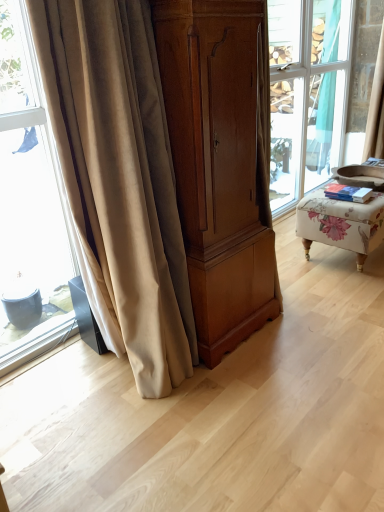
Measure the distance between point (237, 267) and camera.

Point (237, 267) is 5.60 feet away from camera.

Where is `floral fabric ottoman at right`? floral fabric ottoman at right is located at coordinates (341, 223).

Locate an element on the screen. The width and height of the screenshot is (384, 512). beige fabric curtain at upper right, which is the 1th curtain in top-to-bottom order is located at coordinates (376, 109).

Consider the image. From the image's perspective, does beige fabric curtain at upper right, the second curtain ordered from the bottom, appear higher than floral fabric ottoman at right?

Yes, from the image's perspective, beige fabric curtain at upper right, the second curtain ordered from the bottom, is on top of floral fabric ottoman at right.

Considering the sizes of beige fabric curtain at upper right, the first curtain in the back-to-front sequence, and floral fabric ottoman at right in the image, is beige fabric curtain at upper right, the first curtain in the back-to-front sequence, bigger or smaller than floral fabric ottoman at right?

In the image, beige fabric curtain at upper right, the first curtain in the back-to-front sequence, appears to be smaller than floral fabric ottoman at right.

Where is `curtain behind the floral fabric ottoman at right`? This screenshot has width=384, height=512. curtain behind the floral fabric ottoman at right is located at coordinates (376, 109).

From the picture: In terms of width, does beige fabric curtain at upper right, which is the 1th curtain in top-to-bottom order, look wider or thinner when compared to floral fabric ottoman at right?

beige fabric curtain at upper right, which is the 1th curtain in top-to-bottom order, is thinner than floral fabric ottoman at right.

Is beige velvet curtain at left, arranged as the second curtain when viewed from the right, at the left side of beige fabric curtain at upper right, the first curtain in the back-to-front sequence?

Yes, beige velvet curtain at left, arranged as the second curtain when viewed from the right, is to the left of beige fabric curtain at upper right, the first curtain in the back-to-front sequence.

Which is less distant, (108, 201) or (366, 124)?

Clearly, point (108, 201) is closer to the camera than point (366, 124).

Is beige velvet curtain at left, the 1th curtain positioned from the front, facing towards beige fabric curtain at upper right, the second curtain ordered from the bottom?

No, beige velvet curtain at left, the 1th curtain positioned from the front, is not facing towards beige fabric curtain at upper right, the second curtain ordered from the bottom.

How different are the orientations of matte wood cabinet at center and beige fabric curtain at upper right, the first curtain when ordered from right to left, in degrees?

matte wood cabinet at center and beige fabric curtain at upper right, the first curtain when ordered from right to left, are facing 1.39 degrees away from each other.

Considering the relative positions of matte wood cabinet at center and beige fabric curtain at upper right, the second curtain positioned from the front, in the image provided, is matte wood cabinet at center to the right of beige fabric curtain at upper right, the second curtain positioned from the front, from the viewer's perspective?

Incorrect, matte wood cabinet at center is not on the right side of beige fabric curtain at upper right, the second curtain positioned from the front.

Is matte wood cabinet at center far away from beige fabric curtain at upper right, positioned as the second curtain in left-to-right order?

Yes, matte wood cabinet at center is far from beige fabric curtain at upper right, positioned as the second curtain in left-to-right order.

The height and width of the screenshot is (512, 384). I want to click on curtain above the matte wood cabinet at center (from the image's perspective), so click(x=376, y=109).

Between beige fabric curtain at upper right, the second curtain positioned from the front, and matte wood cabinet at center, which one has larger width?

Wider between the two is matte wood cabinet at center.

Measure the distance from beige fabric curtain at upper right, the first curtain when ordered from right to left, to matte wood cabinet at center.

8.12 feet.

At what (x,y) coordinates should I click in order to perform the action: click on cabinetry to the left of beige fabric curtain at upper right, the second curtain positioned from the front. Please return your answer as a coordinate pair (x, y). The image size is (384, 512). Looking at the image, I should click on (217, 164).

Are beige fabric curtain at upper right, which is the 1th curtain in top-to-bottom order, and matte wood cabinet at center far apart?

beige fabric curtain at upper right, which is the 1th curtain in top-to-bottom order, is far away from matte wood cabinet at center.

How distant is floral fabric ottoman at right from beige velvet curtain at left, which is the 2th curtain in top-to-bottom order?

1.24 meters.

Is floral fabric ottoman at right touching beige velvet curtain at left, which is the first curtain from left to right?

No, floral fabric ottoman at right is not in contact with beige velvet curtain at left, which is the first curtain from left to right.

Is point (350, 228) positioned in front of point (70, 125)?

No.

Consider the image. From the image's perspective, is floral fabric ottoman at right located beneath beige velvet curtain at left, arranged as the second curtain when viewed from the right?

No.

Can you tell me how much beige fabric curtain at upper right, the second curtain positioned from the front, and beige velvet curtain at left, which is the first curtain from left to right, differ in facing direction?

There is a 6-degree angle between the facing directions of beige fabric curtain at upper right, the second curtain positioned from the front, and beige velvet curtain at left, which is the first curtain from left to right.

Who is shorter, beige fabric curtain at upper right, positioned as the second curtain in left-to-right order, or beige velvet curtain at left, which ranks as the 1th curtain in bottom-to-top order?

beige fabric curtain at upper right, positioned as the second curtain in left-to-right order.

How much distance is there between beige fabric curtain at upper right, the second curtain positioned from the front, and beige velvet curtain at left, the 1th curtain positioned from the front?

beige fabric curtain at upper right, the second curtain positioned from the front, and beige velvet curtain at left, the 1th curtain positioned from the front, are 9.33 feet apart.

Do you think beige fabric curtain at upper right, the second curtain positioned from the front, is within beige velvet curtain at left, the 2th curtain positioned from the back, or outside of it?

beige fabric curtain at upper right, the second curtain positioned from the front, lies outside beige velvet curtain at left, the 2th curtain positioned from the back.

Is floral fabric ottoman at right shorter than matte wood cabinet at center?

Correct, floral fabric ottoman at right is not as tall as matte wood cabinet at center.

Which is in front, floral fabric ottoman at right or matte wood cabinet at center?

matte wood cabinet at center.

Based on the photo, is floral fabric ottoman at right facing away from matte wood cabinet at center?

No, floral fabric ottoman at right is not facing away from matte wood cabinet at center.

At what (x,y) coordinates should I click in order to perform the action: click on curtain on the right of floral fabric ottoman at right. Please return your answer as a coordinate pair (x, y). The width and height of the screenshot is (384, 512). Looking at the image, I should click on (376, 109).

The height and width of the screenshot is (512, 384). In order to click on curtain above the beige velvet curtain at left, the 1th curtain positioned from the front (from a real-world perspective) in this screenshot , I will do `click(376, 109)`.

When comparing their distances from beige fabric curtain at upper right, which is the 1th curtain in top-to-bottom order, does matte wood cabinet at center or floral fabric ottoman at right seem further?

The object further to beige fabric curtain at upper right, which is the 1th curtain in top-to-bottom order, is matte wood cabinet at center.

Looking at the image, which one is located closer to matte wood cabinet at center, beige velvet curtain at left, arranged as the second curtain when viewed from the right, or floral fabric ottoman at right?

Based on the image, beige velvet curtain at left, arranged as the second curtain when viewed from the right, appears to be nearer to matte wood cabinet at center.

Looking at the image, which one is located further to beige fabric curtain at upper right, the second curtain ordered from the bottom, floral fabric ottoman at right or beige velvet curtain at left, the 1th curtain positioned from the front?

beige velvet curtain at left, the 1th curtain positioned from the front, is further to beige fabric curtain at upper right, the second curtain ordered from the bottom.

Considering their positions, is floral fabric ottoman at right positioned closer to beige fabric curtain at upper right, positioned as the second curtain in left-to-right order, than matte wood cabinet at center?

The object closer to beige fabric curtain at upper right, positioned as the second curtain in left-to-right order, is floral fabric ottoman at right.

Considering their positions, is floral fabric ottoman at right positioned further to matte wood cabinet at center than beige fabric curtain at upper right, the second curtain ordered from the bottom?

beige fabric curtain at upper right, the second curtain ordered from the bottom.

Looking at the image, which one is located further to floral fabric ottoman at right, beige velvet curtain at left, which ranks as the 1th curtain in bottom-to-top order, or beige fabric curtain at upper right, the first curtain in the back-to-front sequence?

beige fabric curtain at upper right, the first curtain in the back-to-front sequence, lies further to floral fabric ottoman at right than the other object.

Considering their positions, is beige fabric curtain at upper right, positioned as the second curtain in left-to-right order, positioned further to beige velvet curtain at left, the 2th curtain positioned from the back, than matte wood cabinet at center?

beige fabric curtain at upper right, positioned as the second curtain in left-to-right order, is further to beige velvet curtain at left, the 2th curtain positioned from the back.

Estimate the real-world distances between objects in this image. Which object is closer to floral fabric ottoman at right, beige fabric curtain at upper right, the first curtain in the back-to-front sequence, or matte wood cabinet at center?

matte wood cabinet at center.

Where is `furniture between beige velvet curtain at left, arranged as the second curtain when viewed from the right, and beige fabric curtain at upper right, the first curtain in the back-to-front sequence, from front to back`? The image size is (384, 512). furniture between beige velvet curtain at left, arranged as the second curtain when viewed from the right, and beige fabric curtain at upper right, the first curtain in the back-to-front sequence, from front to back is located at coordinates (341, 223).

Where is `cabinetry positioned between beige velvet curtain at left, which is the first curtain from left to right, and beige fabric curtain at upper right, the second curtain positioned from the front, from near to far`? The height and width of the screenshot is (512, 384). cabinetry positioned between beige velvet curtain at left, which is the first curtain from left to right, and beige fabric curtain at upper right, the second curtain positioned from the front, from near to far is located at coordinates (217, 164).

Identify the location of cabinetry situated between beige velvet curtain at left, the 2th curtain positioned from the back, and floral fabric ottoman at right from left to right. (217, 164).

Image resolution: width=384 pixels, height=512 pixels. What are the coordinates of `furniture between matte wood cabinet at center and beige fabric curtain at upper right, positioned as the second curtain in left-to-right order, from front to back` in the screenshot? It's located at (341, 223).